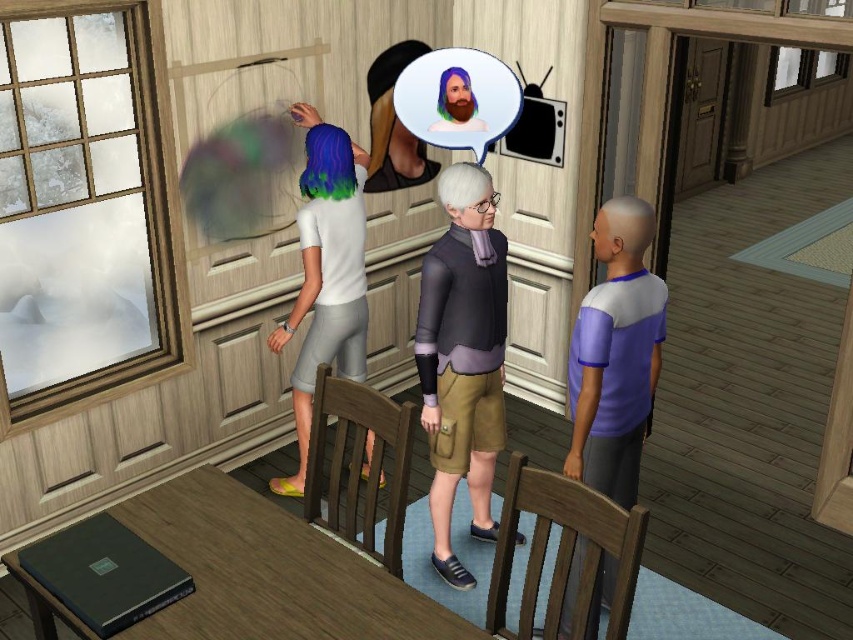
You are trying to decide which character to approach for a conversation. The purple fabric shirt at right and the bearded man at center are both in the room. Which character is physically bigger?

The purple fabric shirt at right is larger in size compared to the bearded man at center, so you should approach the purple fabric shirt at right.